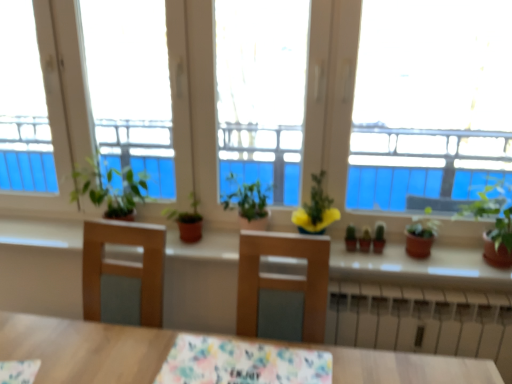
Identify the location of vacant space that's between green matte plant at center, which is the 4th houseplant in right-to-left order, and green matte plant at center, the first houseplant when ordered from left to right. The height and width of the screenshot is (384, 512). (212, 237).